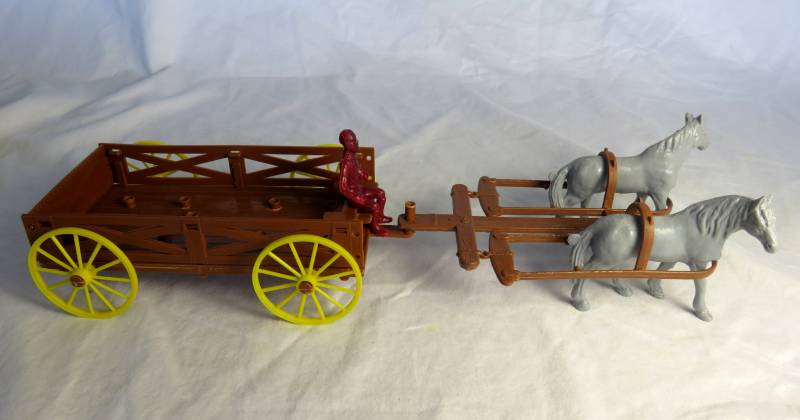
I want to click on toy man, so click(350, 174).